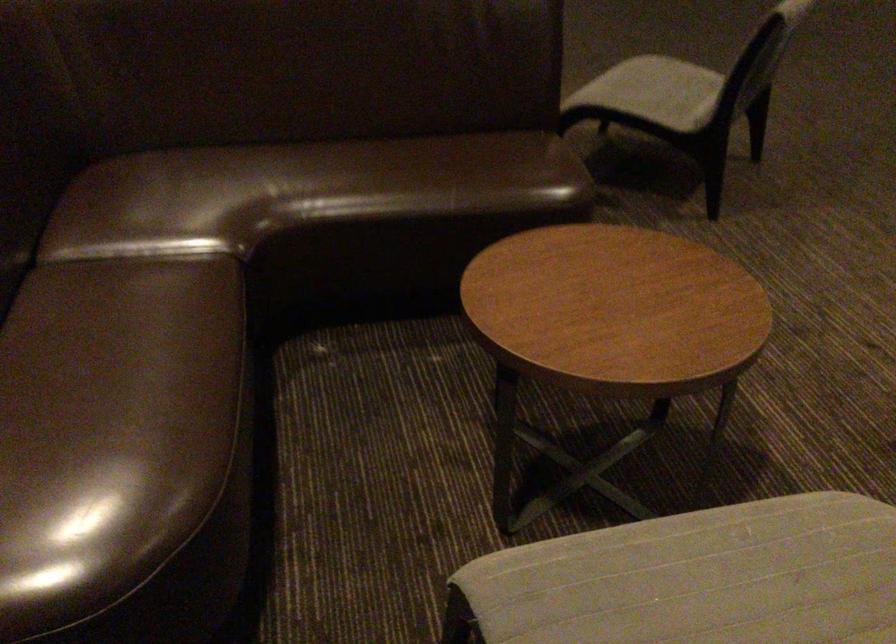
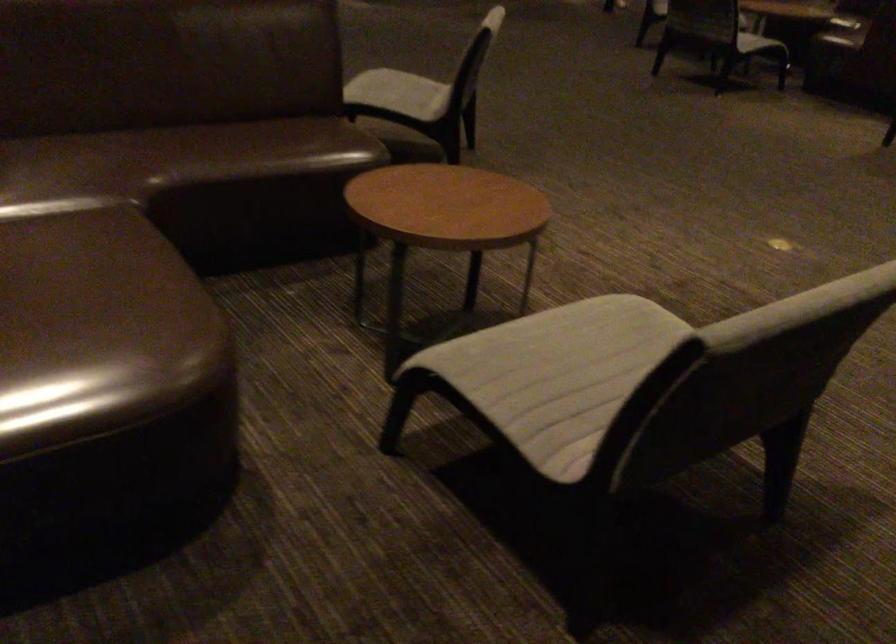
The point at (645, 90) is marked in the first image. Where is the corresponding point in the second image?

(399, 93)